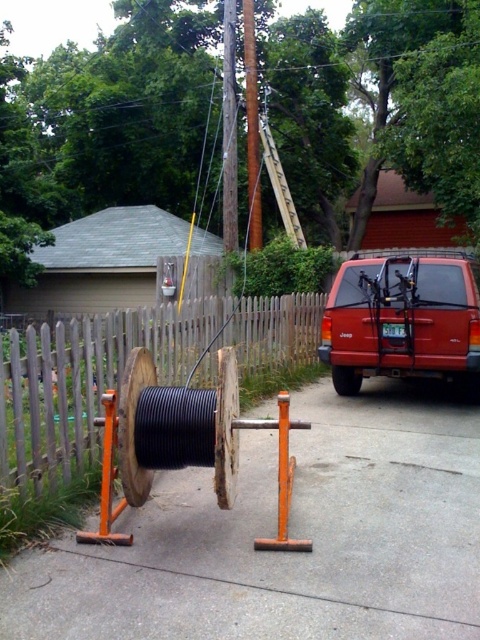
Question: Is black rubber cable at center to the right of wooden picket fence at center from the viewer's perspective?

Choices:
 (A) yes
 (B) no

Answer: (A)

Question: Among these objects, which one is farthest from the camera?

Choices:
 (A) black rubber cable at center
 (B) matte red suv at center right

Answer: (B)

Question: Which point is closer to the camera?

Choices:
 (A) (199, 524)
 (B) (370, 364)
 (C) (24, 444)

Answer: (C)

Question: Does black rubber cable at center have a lesser width compared to matte red suv at center right?

Choices:
 (A) yes
 (B) no

Answer: (B)

Question: Which point is farther to the camera?

Choices:
 (A) black rubber cable at center
 (B) wooden picket fence at center
 (C) matte red suv at center right

Answer: (C)

Question: Is the position of wooden picket fence at center more distant than that of matte red suv at center right?

Choices:
 (A) yes
 (B) no

Answer: (B)